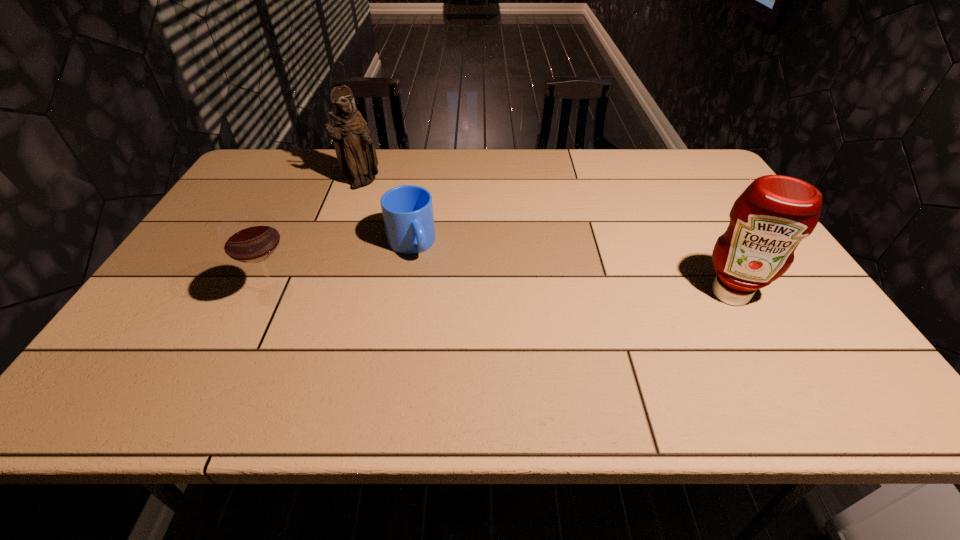
Find the location of `vacant space located 0.270m on the front-facing side of the farthest object`. vacant space located 0.270m on the front-facing side of the farthest object is located at coordinates (430, 224).

Locate an element on the screen. The image size is (960, 540). free space located 0.050m on the front-facing side of the farthest object is located at coordinates (384, 194).

I want to click on vacant space located 0.110m on the front-facing side of the farthest object, so click(x=396, y=202).

At what (x,y) coordinates should I click in order to perform the action: click on object located in the far edge section of the desktop. Please return your answer as a coordinate pair (x, y). The width and height of the screenshot is (960, 540). Looking at the image, I should click on (356, 154).

Image resolution: width=960 pixels, height=540 pixels. What are the coordinates of `object that is at the right edge` in the screenshot? It's located at (771, 217).

Locate an element on the screen. free space at the right edge is located at coordinates (719, 218).

This screenshot has width=960, height=540. In order to click on vacant area at the near right corner in this screenshot , I will do `click(786, 338)`.

At what (x,y) coordinates should I click in order to perform the action: click on free space between the rightmost object and the farthest object. Please return your answer as a coordinate pair (x, y). The image size is (960, 540). Looking at the image, I should click on (546, 238).

Where is `vacant space that's between the third nearest object and the wineglass`? Image resolution: width=960 pixels, height=540 pixels. vacant space that's between the third nearest object and the wineglass is located at coordinates coord(344,269).

Where is `blank region between the rightmost object and the mug`? blank region between the rightmost object and the mug is located at coordinates (570, 269).